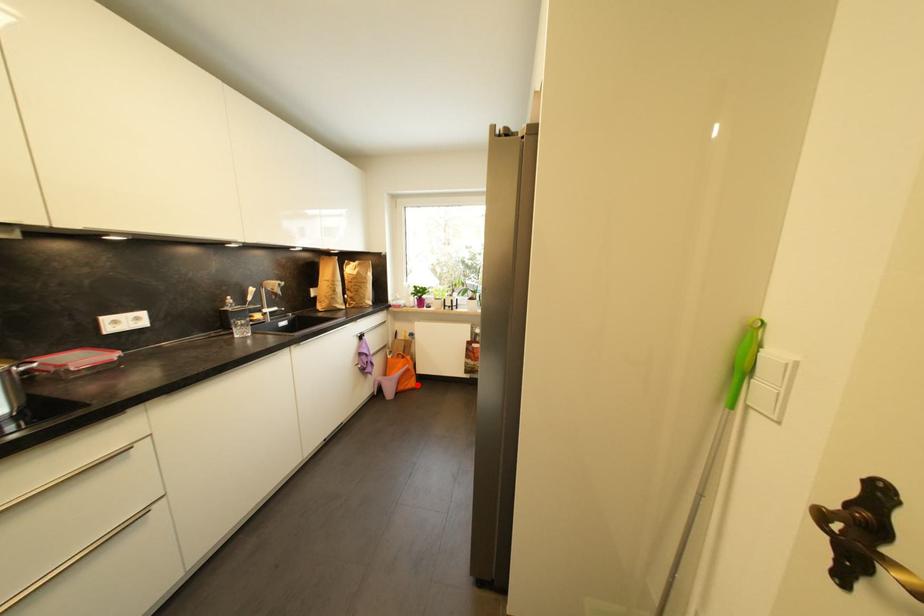
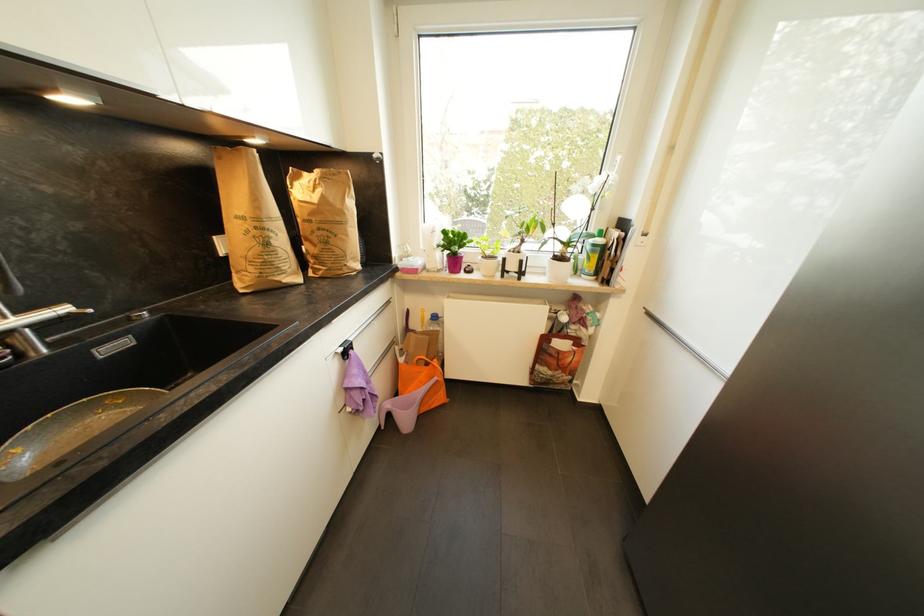
Question: I am providing you with two images of the same scene from different viewpoints. Given a red point in image1, look at the same physical point in image2. Is it:

Choices:
 (A) Closer to the viewpoint
 (B) Farther from the viewpoint

Answer: (A)